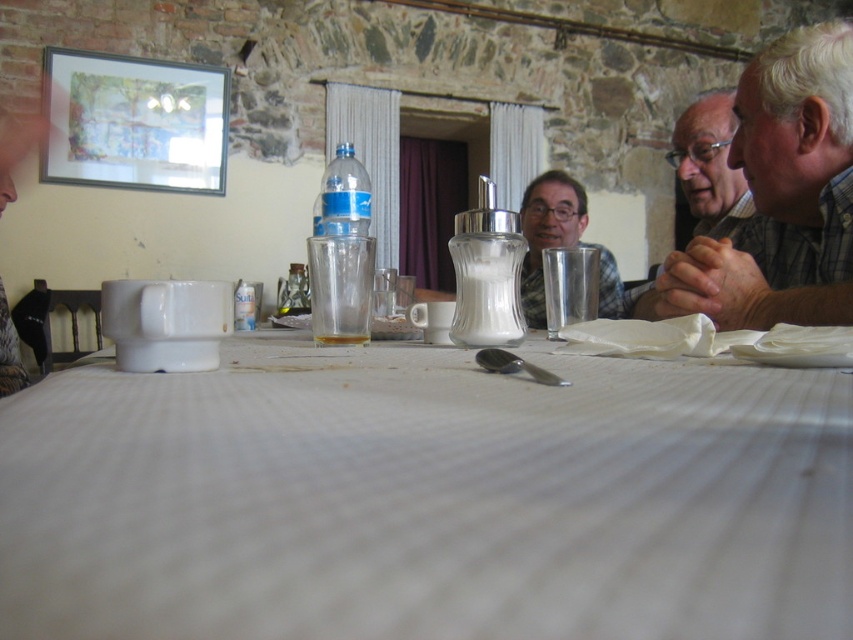
Who is more forward, (523, 564) or (741, 208)?

Point (523, 564) is in front.

Which is behind, point (735, 364) or point (691, 164)?

Positioned behind is point (691, 164).

Is point (784, 600) positioned after point (733, 216)?

No, it is not.

Find the location of a particular element. white textured tablecloth at center is located at coordinates (426, 499).

Does plaid shirt at right lie in front of matte black shirt at upper right?

Yes.

Does point (819, 276) lie behind point (715, 100)?

No, (819, 276) is in front of (715, 100).

Is point (770, 166) more distant than point (717, 97)?

That is False.

Identify the location of plaid shirt at right. (781, 195).

Can you confirm if plaid shirt at right is bigger than translucent glass at center?

No, plaid shirt at right is not bigger than translucent glass at center.

Can you confirm if plaid shirt at right is wider than translucent glass at center?

In fact, plaid shirt at right might be narrower than translucent glass at center.

Does point (819, 195) lie in front of point (524, 228)?

Yes, it is.

Find the location of a particular element. plaid shirt at right is located at coordinates (781, 195).